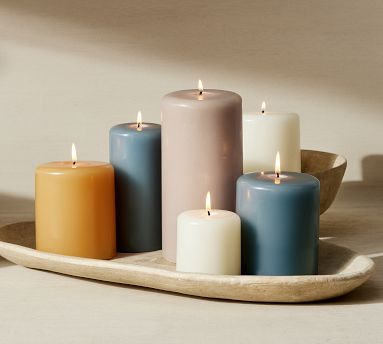
Identify the location of candles with color. The image size is (383, 344). (63, 226), (140, 143), (194, 146), (282, 210).